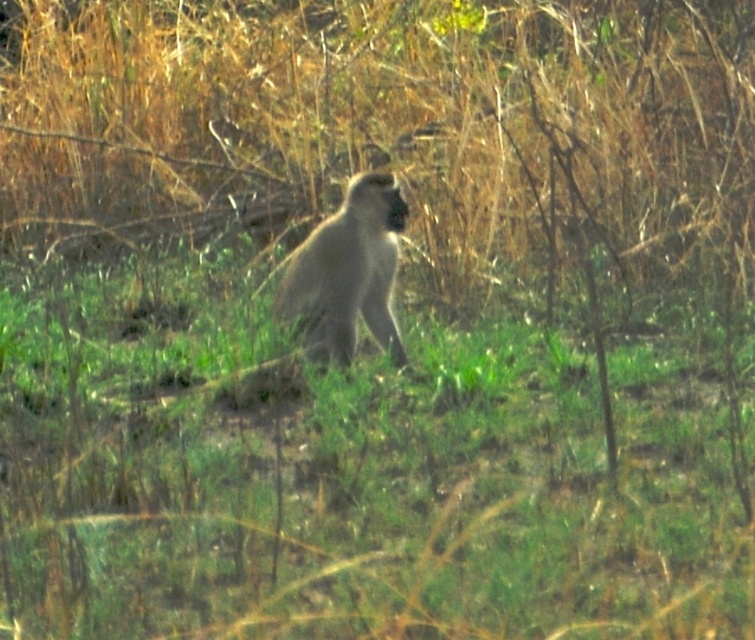
Is green grassy at center positioned at the back of gray fur monkey at center?

No, it is in front of gray fur monkey at center.

The height and width of the screenshot is (640, 755). I want to click on green grassy at center, so click(x=362, y=483).

Does point (328, 611) lie behind point (384, 243)?

No, it is in front of (384, 243).

I want to click on green grassy at center, so click(362, 483).